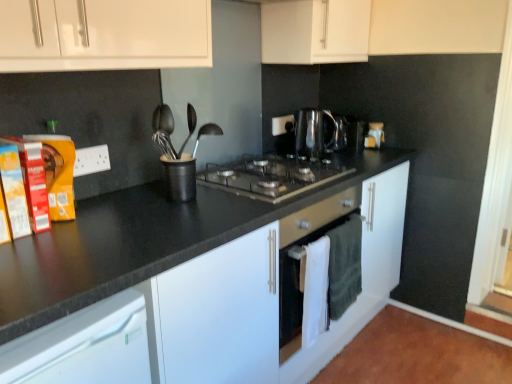
Question: Is black granite countertop at center positioned with its back to black matte utensil holder at center?

Choices:
 (A) yes
 (B) no

Answer: (B)

Question: From the image's perspective, is black granite countertop at center under black matte utensil holder at center?

Choices:
 (A) yes
 (B) no

Answer: (A)

Question: Is black granite countertop at center smaller than black matte utensil holder at center?

Choices:
 (A) no
 (B) yes

Answer: (A)

Question: Is black granite countertop at center outside black matte utensil holder at center?

Choices:
 (A) yes
 (B) no

Answer: (A)

Question: Does black granite countertop at center have a lesser height compared to black matte utensil holder at center?

Choices:
 (A) yes
 (B) no

Answer: (B)

Question: Does black granite countertop at center turn towards black matte utensil holder at center?

Choices:
 (A) yes
 (B) no

Answer: (B)

Question: Is black matte utensil holder at center outside black granite countertop at center?

Choices:
 (A) no
 (B) yes

Answer: (B)

Question: From the image's perspective, is black matte utensil holder at center over black granite countertop at center?

Choices:
 (A) yes
 (B) no

Answer: (A)

Question: Is black matte utensil holder at center touching black granite countertop at center?

Choices:
 (A) yes
 (B) no

Answer: (B)

Question: Is black matte utensil holder at center positioned far away from black granite countertop at center?

Choices:
 (A) no
 (B) yes

Answer: (A)

Question: Does black matte utensil holder at center have a larger size compared to black granite countertop at center?

Choices:
 (A) yes
 (B) no

Answer: (B)

Question: Is black matte utensil holder at center at the left side of black granite countertop at center?

Choices:
 (A) no
 (B) yes

Answer: (B)

Question: Does shiny metallic kettle at center have a greater width compared to black granite countertop at center?

Choices:
 (A) no
 (B) yes

Answer: (A)